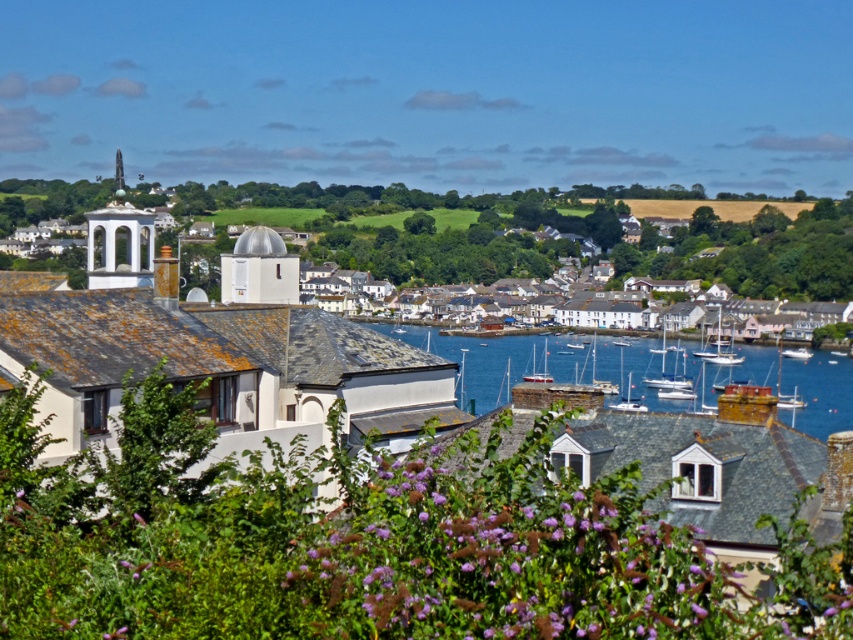
You are standing at the edge of the harbor and see the blue water at center and the white smooth dome at center. Which object is nearer to you?

The blue water at center is closer to the viewer than the white smooth dome at center.

You are a tourist standing in the coastal town and want to take a photo of the white smooth dome at center and the blue water at center. Which object should you place on the left side of your photo to capture both in the frame?

To capture both the white smooth dome at center and the blue water at center in your photo, you should place the white smooth dome at center on the left side of your photo since the blue water at center is positioned on its right side.